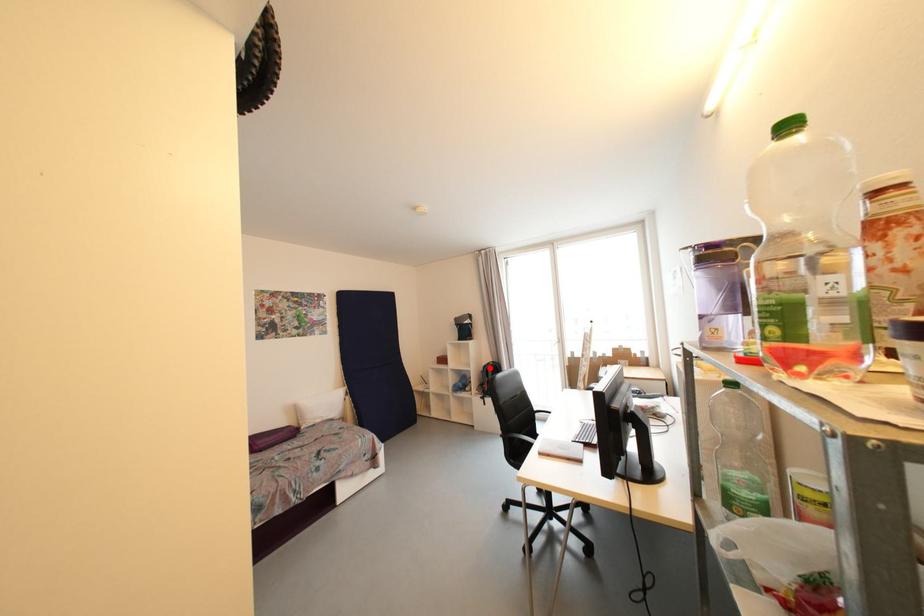
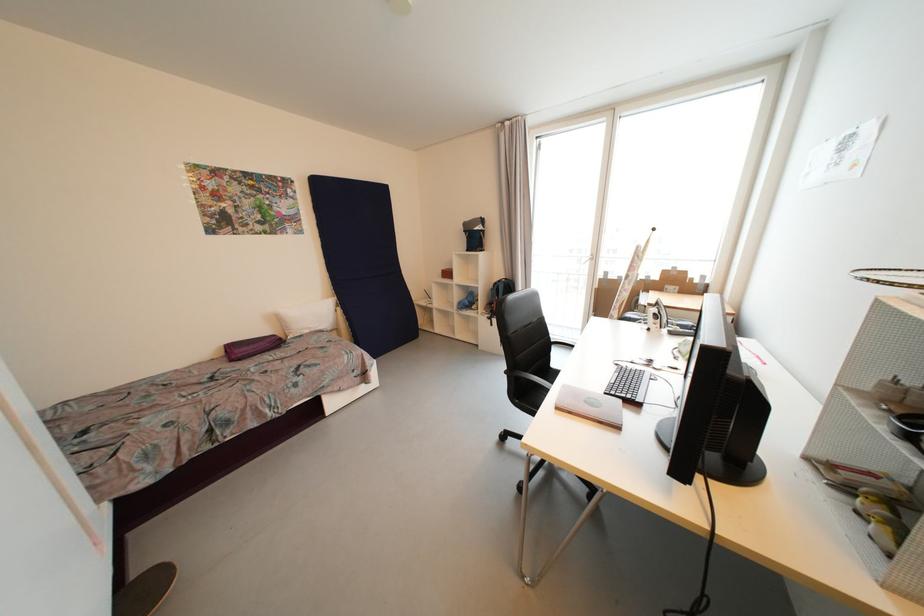
Where in the second image is the point corresponding to the highlighted location from the first image?

(501, 285)